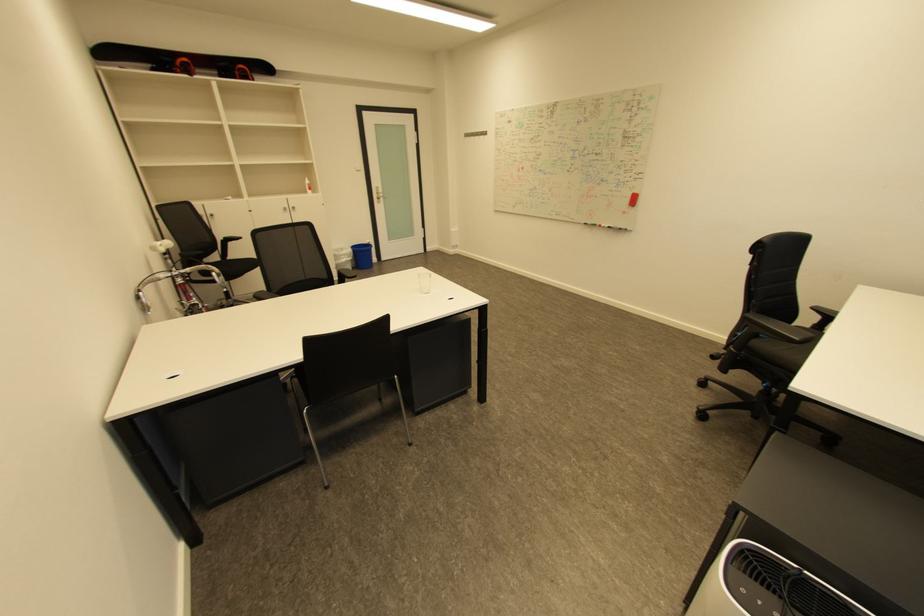
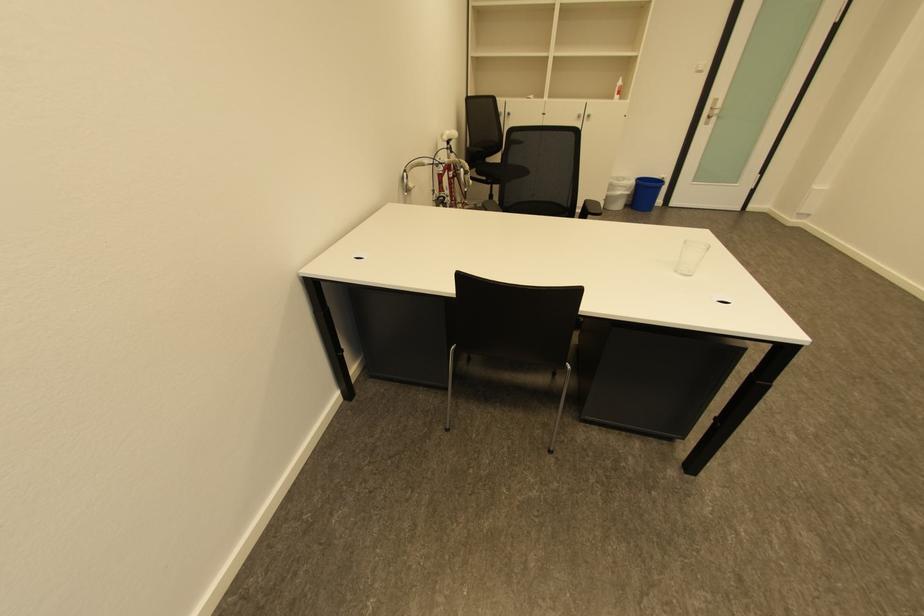
Locate, in the second image, the point that corresponds to pixel 386 199 in the first image.

(715, 119)